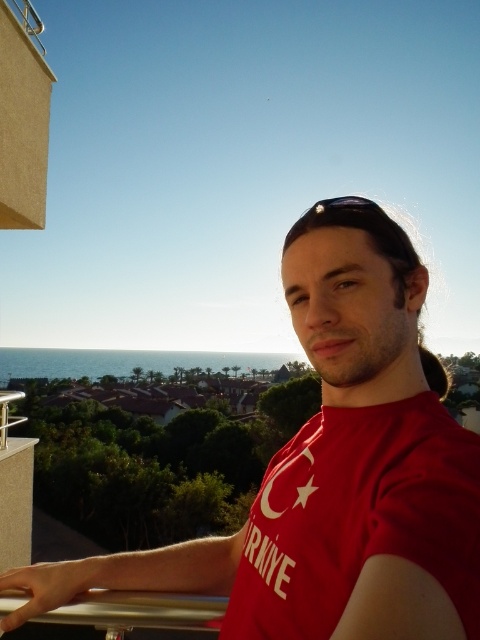
Question: Can you confirm if red matte t-shirt at center is wider than red matte t-shirt at right?

Choices:
 (A) yes
 (B) no

Answer: (B)

Question: Which point is closer to the camera?

Choices:
 (A) red matte t-shirt at center
 (B) red matte t-shirt at right

Answer: (B)

Question: Does red matte t-shirt at center appear over red matte t-shirt at right?

Choices:
 (A) yes
 (B) no

Answer: (A)

Question: Which point is farther to the camera?

Choices:
 (A) (393, 589)
 (B) (393, 460)

Answer: (B)

Question: Does red matte t-shirt at center have a smaller size compared to red matte t-shirt at right?

Choices:
 (A) no
 (B) yes

Answer: (B)